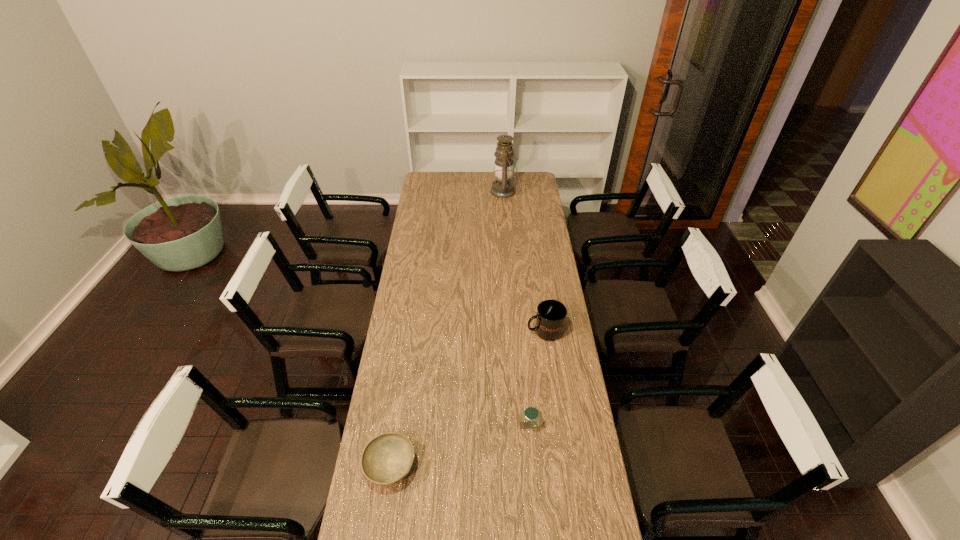
Locate an element on the screen. The width and height of the screenshot is (960, 540). vacant space located with the handle on the side of the third nearest object is located at coordinates (510, 331).

Image resolution: width=960 pixels, height=540 pixels. I want to click on free region located with the handle on the side of the third nearest object, so click(x=493, y=331).

I want to click on free region located 0.110m on the right of the second shortest object, so click(x=573, y=426).

You are a GUI agent. You are given a task and a screenshot of the screen. Output one action in this format:
    pyautogui.click(x=<x>, y=<y>)
    Task: Click on the vacant point located on the right of the bowl
    This screenshot has width=960, height=540.
    Given the screenshot: What is the action you would take?
    pyautogui.click(x=473, y=466)

The height and width of the screenshot is (540, 960). Find the location of `object positioned at the far edge`. object positioned at the far edge is located at coordinates coord(502,187).

This screenshot has width=960, height=540. What are the coordinates of `object that is at the left edge` in the screenshot? It's located at (387, 458).

Where is `oil lamp situated at the right edge`? oil lamp situated at the right edge is located at coordinates (502, 187).

Identify the location of mug that is at the right edge. (551, 315).

This screenshot has width=960, height=540. Find the location of `watch at the right edge`. watch at the right edge is located at coordinates (531, 414).

Where is `object that is at the far right corner`? Image resolution: width=960 pixels, height=540 pixels. object that is at the far right corner is located at coordinates (502, 187).